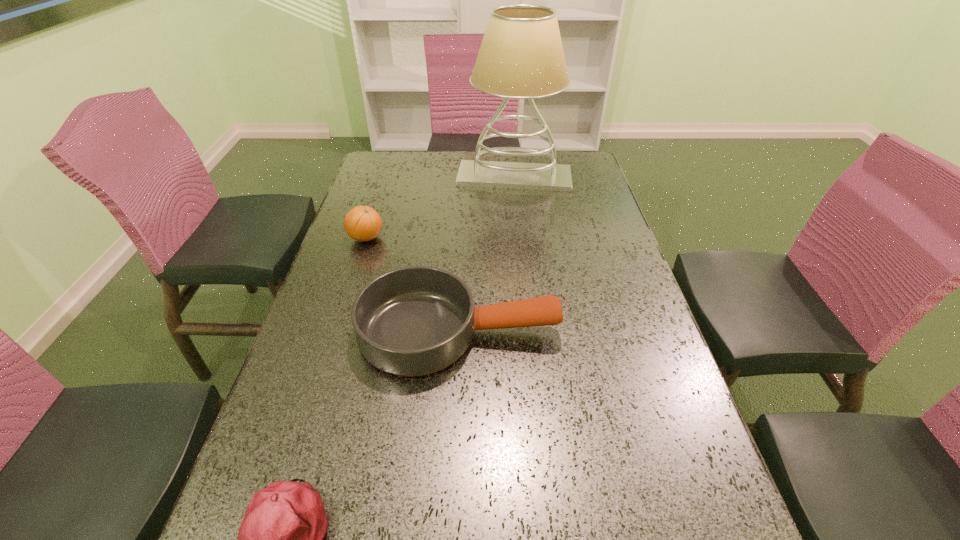
Where is `pan located at the left edge`? Image resolution: width=960 pixels, height=540 pixels. pan located at the left edge is located at coordinates (412, 321).

Locate an element on the screen. This screenshot has height=540, width=960. object positioned at the right edge is located at coordinates (521, 56).

Where is `object that is positioned at the far right corner`? object that is positioned at the far right corner is located at coordinates (521, 56).

In the image, there is a desktop. At what (x,y) coordinates should I click in order to perform the action: click on vacant space at the far edge. Please return your answer as a coordinate pair (x, y). Looking at the image, I should click on (427, 178).

Identify the location of free point at the left edge. (368, 246).

At what (x,y) coordinates should I click in order to perform the action: click on free space at the right edge of the desktop. Please return your answer as a coordinate pair (x, y). The image size is (960, 540). Looking at the image, I should click on (585, 272).

What are the coordinates of `free space at the far left corner` in the screenshot? It's located at (404, 161).

Where is `unoccupied position between the third farthest object and the tallest object`? The height and width of the screenshot is (540, 960). unoccupied position between the third farthest object and the tallest object is located at coordinates (487, 255).

Locate an element on the screen. vacant area that lies between the pan and the farthest object is located at coordinates (487, 255).

At what (x,y) coordinates should I click in order to perform the action: click on vacant area that lies between the third farthest object and the table lamp. Please return your answer as a coordinate pair (x, y). The width and height of the screenshot is (960, 540). Looking at the image, I should click on (487, 255).